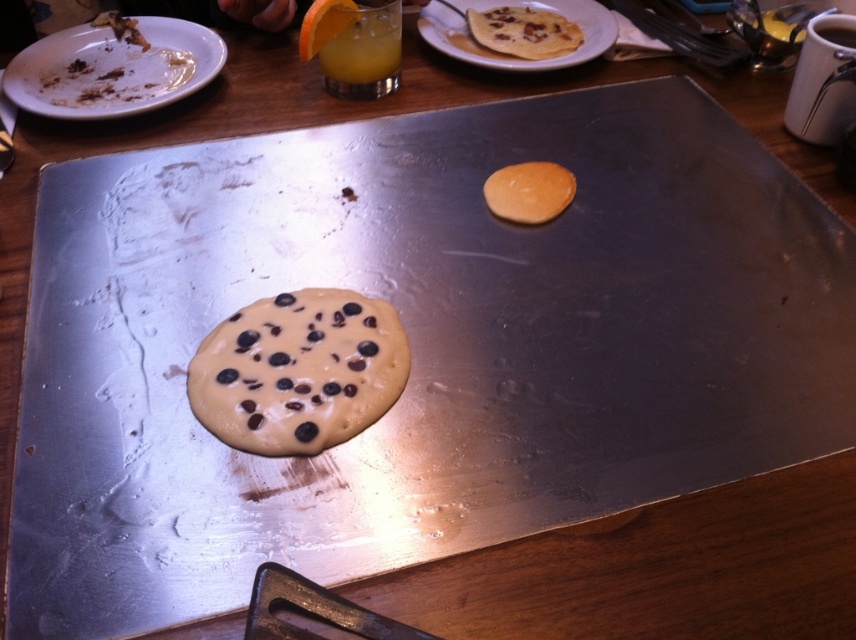
You are a chef preparing breakfast and need to check the thickness of the chocolate chip pancake at center. You have a white matte plate at upper left as a reference. Which object is thicker?

The chocolate chip pancake at center is thinner than the white matte plate at upper left, so the white matte plate at upper left is thicker.

You are a chef preparing breakfast and need to place the chocolate chip pancake at center onto the white matte plate at upper left. Based on their sizes, will the pancake fit on the plate without overhanging the edges?

The chocolate chip pancake at center is smaller than the white matte plate at upper left, so it will fit without overhanging the edges.